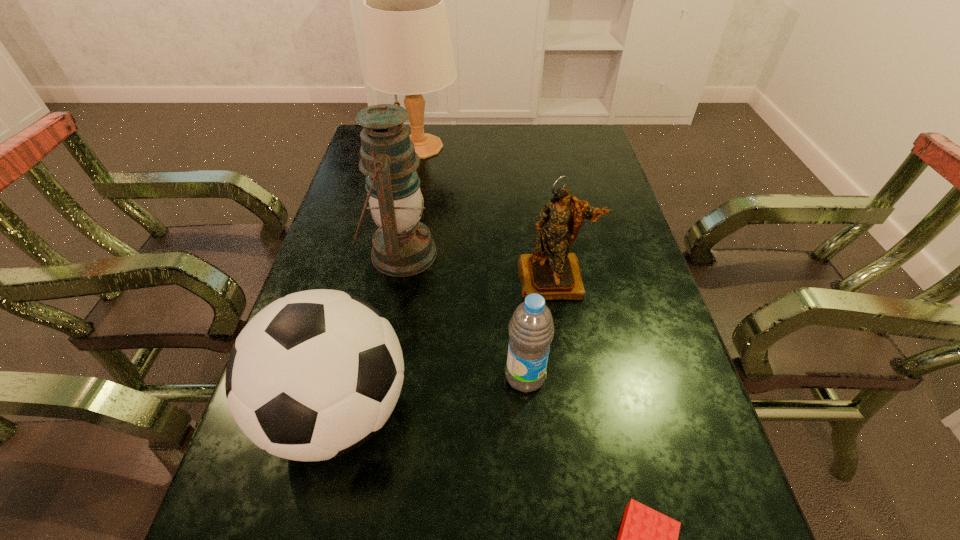
Locate an element on the screen. Image resolution: width=960 pixels, height=540 pixels. the farthest object is located at coordinates (408, 50).

Where is `oil lamp`? oil lamp is located at coordinates (402, 246).

What are the coordinates of `figurine` in the screenshot? It's located at (551, 271).

Find the location of `soccer ball`. soccer ball is located at coordinates (315, 374).

Identify the location of the second shortest object. Image resolution: width=960 pixels, height=540 pixels. (531, 329).

Where is `vacant space located on the right of the table lamp`? vacant space located on the right of the table lamp is located at coordinates (494, 147).

I want to click on vacant area located on the front of the oil lamp, so click(378, 374).

The height and width of the screenshot is (540, 960). What are the coordinates of `vacant space situated on the front-facing side of the figurine` in the screenshot? It's located at (564, 339).

What are the coordinates of `free location located on the front of the soccer ball` in the screenshot? It's located at (312, 521).

Where is `free space located on the left of the water bottle`? This screenshot has height=540, width=960. free space located on the left of the water bottle is located at coordinates (441, 377).